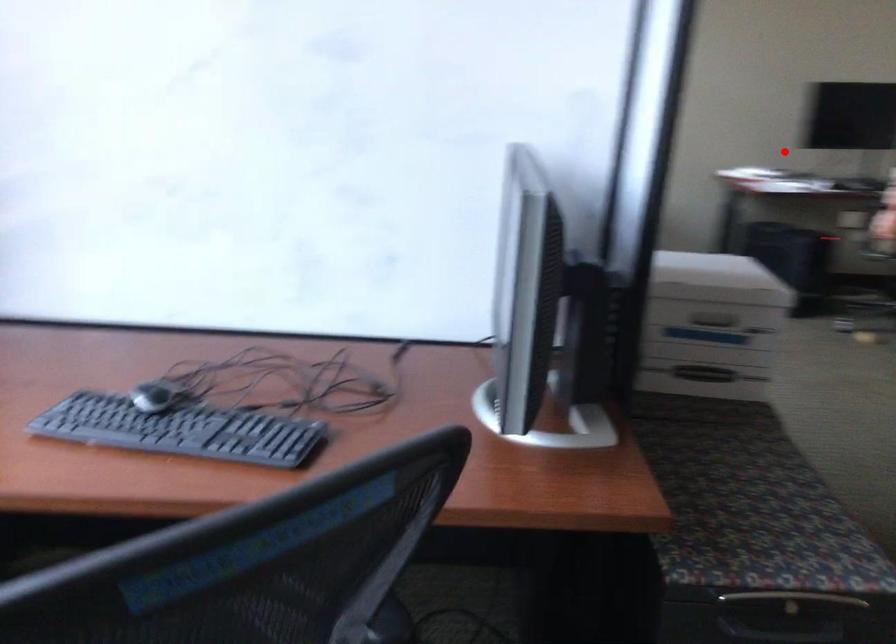
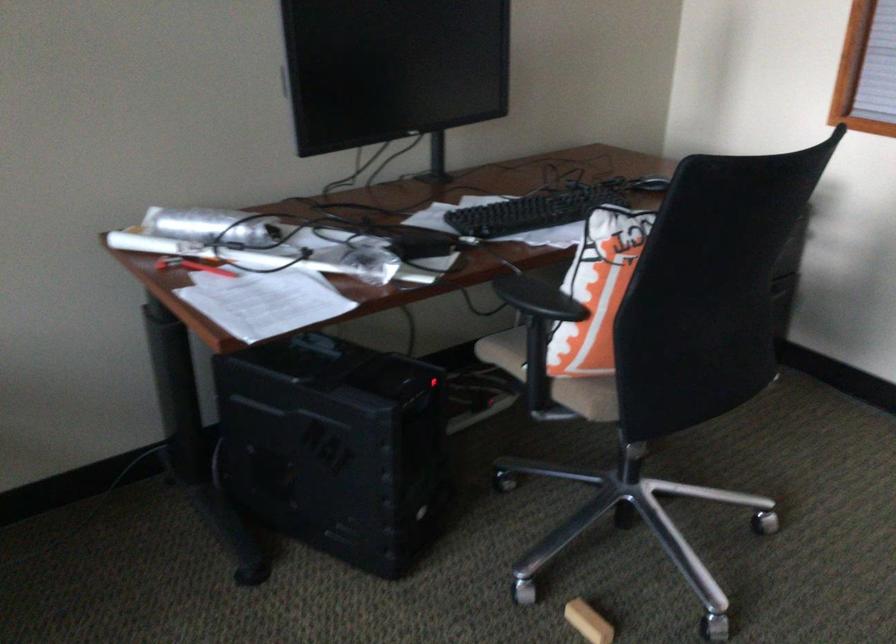
Question: I am providing you with two images of the same scene from different viewpoints. Given a red point in image1, look at the same physical point in image2. Is it:

Choices:
 (A) Closer to the viewpoint
 (B) Farther from the viewpoint

Answer: (A)